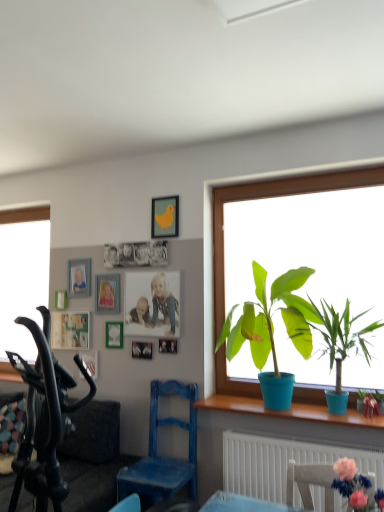
The height and width of the screenshot is (512, 384). What do you see at coordinates (271, 319) in the screenshot?
I see `green matte plant at window, which is counted as the 1th houseplant, starting from the left` at bounding box center [271, 319].

Identify the location of blue plastic pot at window, placed as the second houseplant when sorted from right to left. This screenshot has height=512, width=384. (340, 344).

At what (x,y) coordinates should I click in order to perform the action: click on blue wooden picture frame at upper center, arranged as the sixth picture frame when viewed from the right. Please return your answer as a coordinate pair (x, y). The image size is (384, 512). Looking at the image, I should click on (107, 294).

What is the approximate height of green matte plant at right, positioned as the third houseplant in left-to-right order?

green matte plant at right, positioned as the third houseplant in left-to-right order, is 5.89 inches tall.

Where is `matte wooden picture frame at upper center, acting as the second picture frame starting from the left`? This screenshot has width=384, height=512. matte wooden picture frame at upper center, acting as the second picture frame starting from the left is located at coordinates (79, 278).

Locate an element on the screen. Image resolution: width=384 pixels, height=512 pixels. dark gray fabric couch at lower left is located at coordinates (92, 458).

Is matte white picture frame at upper left, which appears as the 1th picture frame when viewed from the left, positioned with its back to blue wooden picture frame at upper center, arranged as the sixth picture frame when viewed from the right?

No, matte white picture frame at upper left, which appears as the 1th picture frame when viewed from the left,'s orientation is not away from blue wooden picture frame at upper center, arranged as the sixth picture frame when viewed from the right.

Do you think matte white picture frame at upper left, which appears as the 1th picture frame when viewed from the left, is within blue wooden picture frame at upper center, marked as the third picture frame in a left-to-right arrangement, or outside of it?

matte white picture frame at upper left, which appears as the 1th picture frame when viewed from the left, cannot be found inside blue wooden picture frame at upper center, marked as the third picture frame in a left-to-right arrangement.

Is the surface of matte white picture frame at upper left, the 8th picture frame viewed from the right, in direct contact with blue wooden picture frame at upper center, marked as the third picture frame in a left-to-right arrangement?

matte white picture frame at upper left, the 8th picture frame viewed from the right, is not next to blue wooden picture frame at upper center, marked as the third picture frame in a left-to-right arrangement, and they're not touching.

Do you think white fabric chair at lower right, the second chair from the back, is within green matte plant at window, the 3th houseplant in the right-to-left sequence, or outside of it?

white fabric chair at lower right, the second chair from the back, cannot be found inside green matte plant at window, the 3th houseplant in the right-to-left sequence.

Is white fabric chair at lower right, the second chair from the back, touching green matte plant at window, which is counted as the 1th houseplant, starting from the left?

No.

From the picture: From a real-world perspective, which is physically above, white fabric chair at lower right, which is counted as the 1th chair, starting from the right, or green matte plant at window, which is counted as the 1th houseplant, starting from the left?

From a 3D spatial view, green matte plant at window, which is counted as the 1th houseplant, starting from the left, is above.

Considering the relative sizes of white fabric chair at lower right, which is counted as the 1th chair, starting from the right, and green matte plant at window, which is counted as the 1th houseplant, starting from the left, in the image provided, is white fabric chair at lower right, which is counted as the 1th chair, starting from the right, wider than green matte plant at window, which is counted as the 1th houseplant, starting from the left,?

No.

Is matte white picture frame at upper left, the 8th picture frame viewed from the right, to the left or to the right of metallic silver photo frame at upper center, acting as the first picture frame starting from the right, in the image?

From the image, it's evident that matte white picture frame at upper left, the 8th picture frame viewed from the right, is to the left of metallic silver photo frame at upper center, acting as the first picture frame starting from the right.

How much distance is there between matte white picture frame at upper left, which appears as the 1th picture frame when viewed from the left, and metallic silver photo frame at upper center, acting as the first picture frame starting from the right?

A distance of 1.04 meters exists between matte white picture frame at upper left, which appears as the 1th picture frame when viewed from the left, and metallic silver photo frame at upper center, acting as the first picture frame starting from the right.

From a real-world perspective, is matte white picture frame at upper left, which appears as the 1th picture frame when viewed from the left, beneath metallic silver photo frame at upper center, acting as the first picture frame starting from the right?

Incorrect, from a real-world perspective, matte white picture frame at upper left, which appears as the 1th picture frame when viewed from the left, is higher than metallic silver photo frame at upper center, acting as the first picture frame starting from the right.

From the image's perspective, which is above, matte white picture frame at upper left, which appears as the 1th picture frame when viewed from the left, or metallic silver photo frame at upper center, placed as the eighth picture frame when sorted from left to right?

matte white picture frame at upper left, which appears as the 1th picture frame when viewed from the left.

Is matte yellow bird at upper center, which appears as the second picture frame when viewed from the right, far from blue plastic pot at window, marked as the 2th houseplant in a left-to-right arrangement?

Yes, matte yellow bird at upper center, which appears as the second picture frame when viewed from the right, is far from blue plastic pot at window, marked as the 2th houseplant in a left-to-right arrangement.

From the picture: From a real-world perspective, is matte yellow bird at upper center, which appears as the seventh picture frame when viewed from the left, on top of blue plastic pot at window, marked as the 2th houseplant in a left-to-right arrangement?

Correct, in the physical world, matte yellow bird at upper center, which appears as the seventh picture frame when viewed from the left, is higher than blue plastic pot at window, marked as the 2th houseplant in a left-to-right arrangement.

From the image's perspective, is matte yellow bird at upper center, which appears as the second picture frame when viewed from the right, over blue plastic pot at window, placed as the second houseplant when sorted from right to left?

Yes, from the image's perspective, matte yellow bird at upper center, which appears as the second picture frame when viewed from the right, is above blue plastic pot at window, placed as the second houseplant when sorted from right to left.

Can you confirm if dark gray fabric couch at lower left is positioned to the right of blue wooden picture frame at upper center, marked as the third picture frame in a left-to-right arrangement?

In fact, dark gray fabric couch at lower left is to the left of blue wooden picture frame at upper center, marked as the third picture frame in a left-to-right arrangement.

Does point (110, 501) appear closer or farther from the camera than point (102, 311)?

Point (110, 501) is closer to the camera than point (102, 311).

Can you see matte yellow bird at upper center, which appears as the second picture frame when viewed from the right, touching matte wooden picture frame at upper center, acting as the second picture frame starting from the left?

No, matte yellow bird at upper center, which appears as the second picture frame when viewed from the right, is not touching matte wooden picture frame at upper center, acting as the second picture frame starting from the left.

Is matte yellow bird at upper center, which appears as the second picture frame when viewed from the right, behind matte wooden picture frame at upper center, arranged as the seventh picture frame when viewed from the right?

No, it is not.

From the image's perspective, which one is positioned lower, matte yellow bird at upper center, which appears as the second picture frame when viewed from the right, or matte wooden picture frame at upper center, arranged as the seventh picture frame when viewed from the right?

matte wooden picture frame at upper center, arranged as the seventh picture frame when viewed from the right, from the image's perspective.

Looking at this image, is green matte picture frame at upper center, which is the 4th picture frame in left-to-right order, facing towards metallic silver photo frame at upper center, acting as the first picture frame starting from the right?

No, green matte picture frame at upper center, which is the 4th picture frame in left-to-right order, is not facing towards metallic silver photo frame at upper center, acting as the first picture frame starting from the right.

Measure the distance between green matte picture frame at upper center, the fifth picture frame when ordered from right to left, and metallic silver photo frame at upper center, acting as the first picture frame starting from the right.

green matte picture frame at upper center, the fifth picture frame when ordered from right to left, is 17.05 inches away from metallic silver photo frame at upper center, acting as the first picture frame starting from the right.

Is point (108, 333) closer or farther from the camera than point (169, 346)?

Point (108, 333) appears to be farther away from the viewer than point (169, 346).

Are green matte picture frame at upper center, the fifth picture frame when ordered from right to left, and metallic silver photo frame at upper center, placed as the eighth picture frame when sorted from left to right, far apart?

green matte picture frame at upper center, the fifth picture frame when ordered from right to left, is actually quite close to metallic silver photo frame at upper center, placed as the eighth picture frame when sorted from left to right.

In order to click on picture frame that is the 2nd one when counting leftward from the blue wooden picture frame at upper center, marked as the third picture frame in a left-to-right arrangement in this screenshot , I will do `click(60, 298)`.

From the image's perspective, which chair is the 1st one below the green matte plant at window, the 3th houseplant in the right-to-left sequence? Please provide its 2D coordinates.

[(310, 483)]

Estimate the real-world distances between objects in this image. Which object is further from matte white picture frame at upper left, which appears as the 1th picture frame when viewed from the left, wooden photo frame at upper center, acting as the 4th picture frame starting from the right, or blue wooden picture frame at upper center, arranged as the sixth picture frame when viewed from the right?

wooden photo frame at upper center, acting as the 4th picture frame starting from the right, is positioned further to the anchor matte white picture frame at upper left, which appears as the 1th picture frame when viewed from the left.

Considering their positions, is metallic silver photo frame at upper center, placed as the eighth picture frame when sorted from left to right, positioned further to wooden photo frame at upper center, acting as the 5th picture frame starting from the left, than white fabric chair at lower right, placed as the second chair when sorted from left to right?

white fabric chair at lower right, placed as the second chair when sorted from left to right, lies further to wooden photo frame at upper center, acting as the 5th picture frame starting from the left, than the other object.

Estimate the real-world distances between objects in this image. Which object is further from blue plastic pot at window, marked as the 2th houseplant in a left-to-right arrangement, green matte plant at right, positioned as the third houseplant in left-to-right order, or blue painted wood chair at center, which is counted as the first chair, starting from the left?

blue painted wood chair at center, which is counted as the first chair, starting from the left.

In the scene shown: From the image, which object appears to be nearer to matte wooden picture frame at upper center, arranged as the seventh picture frame when viewed from the right, green matte plant at right, positioned as the third houseplant in left-to-right order, or green matte plant at window, which is counted as the 1th houseplant, starting from the left?

green matte plant at window, which is counted as the 1th houseplant, starting from the left, is closer to matte wooden picture frame at upper center, arranged as the seventh picture frame when viewed from the right.

Estimate the real-world distances between objects in this image. Which object is closer to matte wooden picture frame at upper center, which is counted as the 6th picture frame, starting from the left, green matte plant at right, which ranks as the first houseplant in right-to-left order, or metallic silver photo frame at upper center, placed as the eighth picture frame when sorted from left to right?

metallic silver photo frame at upper center, placed as the eighth picture frame when sorted from left to right.

From the image, which object appears to be nearer to matte yellow bird at upper center, which appears as the seventh picture frame when viewed from the left, green matte plant at window, which is counted as the 1th houseplant, starting from the left, or green matte plant at right, which ranks as the first houseplant in right-to-left order?

Based on the image, green matte plant at window, which is counted as the 1th houseplant, starting from the left, appears to be nearer to matte yellow bird at upper center, which appears as the seventh picture frame when viewed from the left.

Looking at the image, which one is located closer to matte wooden picture frame at upper center, positioned as the 3th picture frame in right-to-left order, matte wooden picture frame at upper center, arranged as the seventh picture frame when viewed from the right, or blue wooden picture frame at upper center, arranged as the sixth picture frame when viewed from the right?

blue wooden picture frame at upper center, arranged as the sixth picture frame when viewed from the right.

When comparing their distances from matte wooden picture frame at upper center, arranged as the seventh picture frame when viewed from the right, does white fabric chair at lower right, placed as the second chair when sorted from left to right, or matte yellow bird at upper center, which appears as the second picture frame when viewed from the right, seem further?

white fabric chair at lower right, placed as the second chair when sorted from left to right, is positioned further to the anchor matte wooden picture frame at upper center, arranged as the seventh picture frame when viewed from the right.

What are the coordinates of `chair located between dark gray fabric couch at lower left and green matte plant at window, which is counted as the 1th houseplant, starting from the left, in the left-right direction` in the screenshot? It's located at (164, 457).

Where is `couch positioned between white fabric chair at lower right, positioned as the first chair in top-to-bottom order, and matte white picture frame at upper left, which appears as the 1th picture frame when viewed from the left, from near to far`? This screenshot has height=512, width=384. couch positioned between white fabric chair at lower right, positioned as the first chair in top-to-bottom order, and matte white picture frame at upper left, which appears as the 1th picture frame when viewed from the left, from near to far is located at coordinates (92, 458).

Where is `chair between white fabric chair at lower right, which is the first chair in front-to-back order, and matte white picture frame at upper left, the 8th picture frame viewed from the right, along the z-axis`? chair between white fabric chair at lower right, which is the first chair in front-to-back order, and matte white picture frame at upper left, the 8th picture frame viewed from the right, along the z-axis is located at coordinates (164, 457).

The image size is (384, 512). Find the location of `couch between matte white picture frame at upper left, the 8th picture frame viewed from the right, and blue plastic pot at window, marked as the 2th houseplant in a left-to-right arrangement, in the horizontal direction`. couch between matte white picture frame at upper left, the 8th picture frame viewed from the right, and blue plastic pot at window, marked as the 2th houseplant in a left-to-right arrangement, in the horizontal direction is located at coordinates [92, 458].